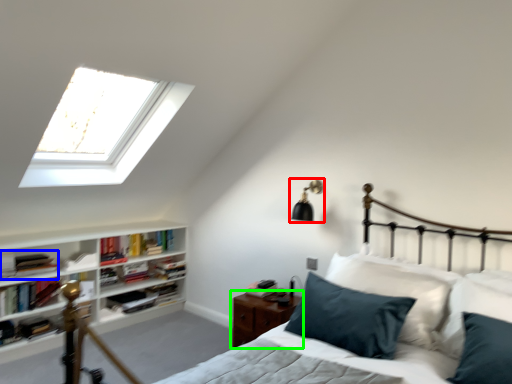
Question: Based on their relative distances, which object is nearer to light fixture (highlighted by a red box)? Choose from book (highlighted by a blue box) and nightstand (highlighted by a green box).

Choices:
 (A) book
 (B) nightstand

Answer: (B)